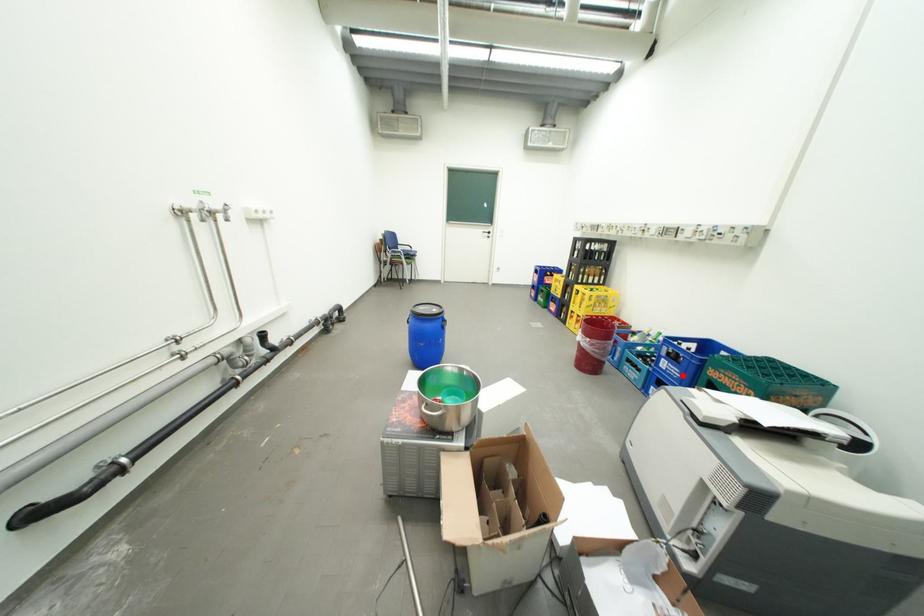
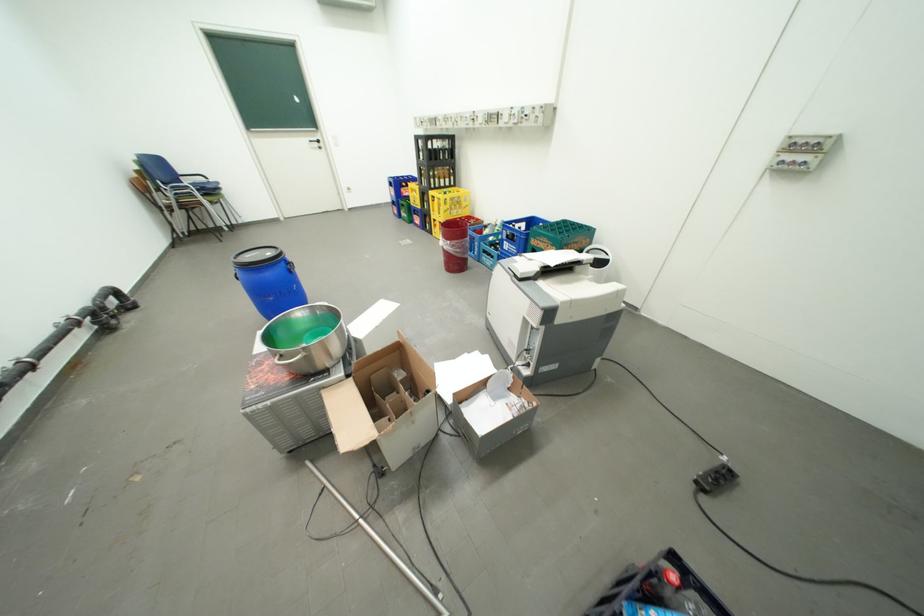
Locate, in the second image, the point that corresponds to the highlighted location in the first image.

(523, 253)